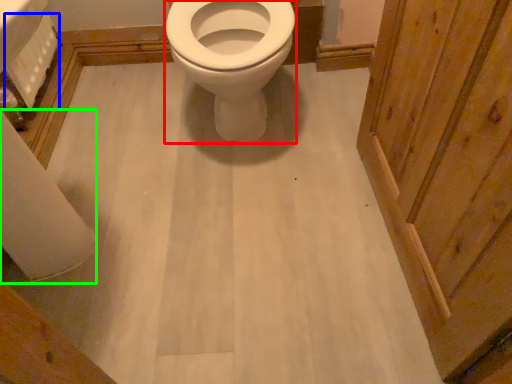
Question: Estimate the real-world distances between objects in this image. Which object is farther from bidet (highlighted by a red box), toilet paper (highlighted by a blue box) or toilet paper (highlighted by a green box)?

Choices:
 (A) toilet paper
 (B) toilet paper

Answer: (B)